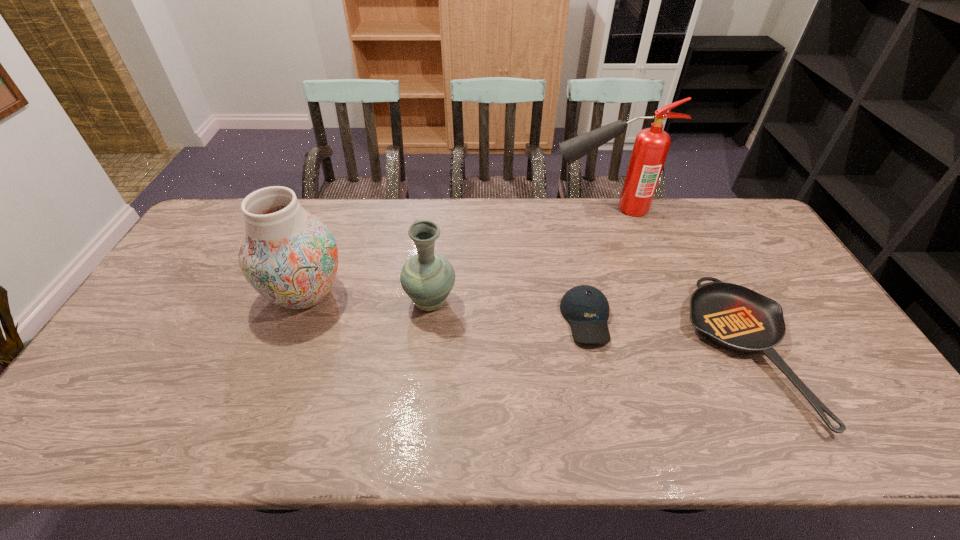
Locate an element on the screen. This screenshot has width=960, height=540. object that is positioned at the near right corner is located at coordinates (737, 318).

You are a GUI agent. You are given a task and a screenshot of the screen. Output one action in this format:
    pyautogui.click(x=<x>, y=<y>)
    Task: Click on the vacant space at the far edge
    
    Given the screenshot: What is the action you would take?
    pyautogui.click(x=614, y=211)

Locate an element on the screen. vacant space at the near edge of the desktop is located at coordinates (377, 449).

Where is `vacant space at the left edge of the desktop`? vacant space at the left edge of the desktop is located at coordinates (164, 278).

The height and width of the screenshot is (540, 960). I want to click on free spot at the right edge of the desktop, so click(757, 264).

You are a GUI agent. You are given a task and a screenshot of the screen. Output one action in this format:
    pyautogui.click(x=<x>, y=<y>)
    Task: Click on the vacant space at the far right corner
    Image resolution: width=960 pixels, height=540 pixels.
    Given the screenshot: What is the action you would take?
    pos(739,208)

This screenshot has height=540, width=960. In order to click on free space between the fire extinguisher and the baseball cap in this screenshot , I will do `click(596, 264)`.

Locate an element on the screen. blank region between the fourth tallest object and the fire extinguisher is located at coordinates (596, 264).

Identify the location of vacant space that's between the fourth shortest object and the baseball cap. (446, 307).

Identify the location of empty space between the farthest object and the second shortest object. (596, 264).